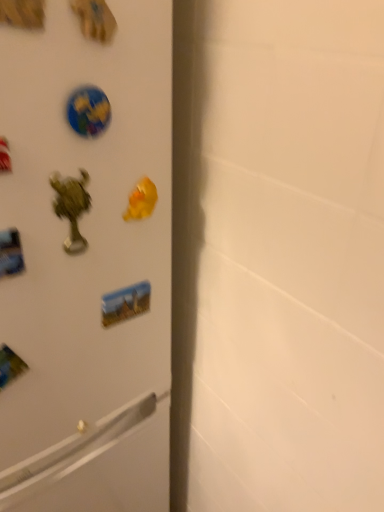
Question: From a real-world perspective, is gold metallic magnet at center physically located above or below matte plastic sticker at center, positioned as the 1th sticker in back-to-front order?

Choices:
 (A) above
 (B) below

Answer: (A)

Question: Considering the positions of gold metallic magnet at center and matte plastic sticker at center, the 2th sticker from the top, in the image, is gold metallic magnet at center wider or thinner than matte plastic sticker at center, the 2th sticker from the top,?

Choices:
 (A) wide
 (B) thin

Answer: (A)

Question: Which of these objects is positioned closest to the matte plastic sticker at center, the 1th sticker ordered from the bottom?

Choices:
 (A) white matte refrigerator at left
 (B) gold metallic magnet at center
 (C) glossy plastic globe at upper left, positioned as the 1th sticker in front-to-back order

Answer: (B)

Question: Which of these objects is positioned farthest from the white matte refrigerator at left?

Choices:
 (A) matte plastic sticker at center, the 1th sticker ordered from the bottom
 (B) gold metallic magnet at center
 (C) glossy plastic globe at upper left, the 2th sticker in the bottom-to-top sequence

Answer: (C)